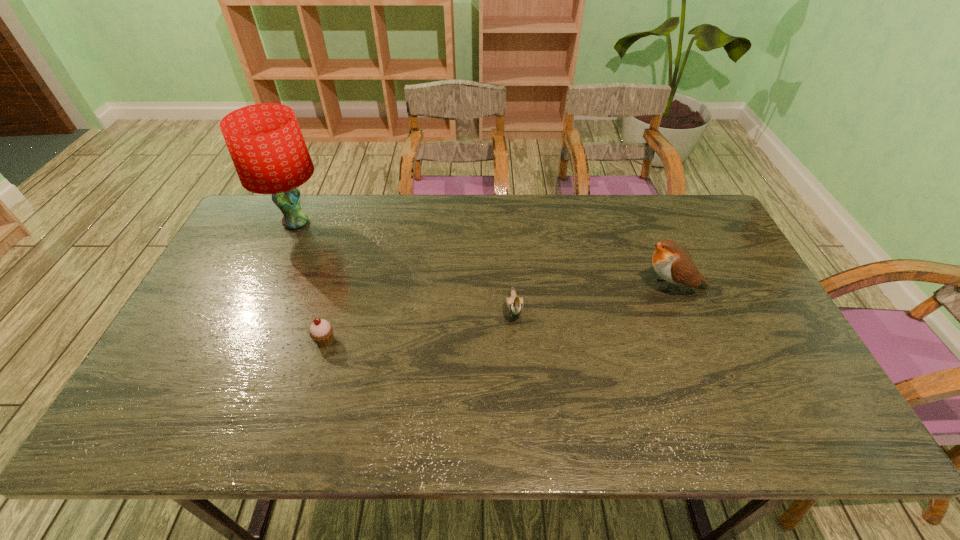
Find the location of a particular element. The height and width of the screenshot is (540, 960). vacant space located at the face of the rightmost object is located at coordinates (578, 286).

This screenshot has width=960, height=540. I want to click on vacant point located at the face of the rightmost object, so click(x=558, y=286).

Image resolution: width=960 pixels, height=540 pixels. Identify the location of free space located at the face of the left bird. pyautogui.click(x=519, y=389).

Image resolution: width=960 pixels, height=540 pixels. I want to click on free location located on the left of the second object from left to right, so click(218, 340).

You are a GUI agent. You are given a task and a screenshot of the screen. Output one action in this format:
    pyautogui.click(x=<x>, y=<y>)
    Task: Click on the object present at the far edge
    The width and height of the screenshot is (960, 540).
    Given the screenshot: What is the action you would take?
    pyautogui.click(x=265, y=142)

This screenshot has height=540, width=960. Identify the location of object located in the left edge section of the desktop. (265, 142).

The width and height of the screenshot is (960, 540). In order to click on object located at the right edge in this screenshot , I will do `click(673, 263)`.

Where is `object situated at the far left corner`? The height and width of the screenshot is (540, 960). object situated at the far left corner is located at coordinates (265, 142).

This screenshot has height=540, width=960. Identify the location of free space at the far edge of the desktop. (638, 230).

You are a GUI agent. You are given a task and a screenshot of the screen. Output one action in this format:
    pyautogui.click(x=<x>, y=<y>)
    Task: Click on the free space at the near edge of the desktop
    The height and width of the screenshot is (540, 960).
    Given the screenshot: What is the action you would take?
    pyautogui.click(x=325, y=432)